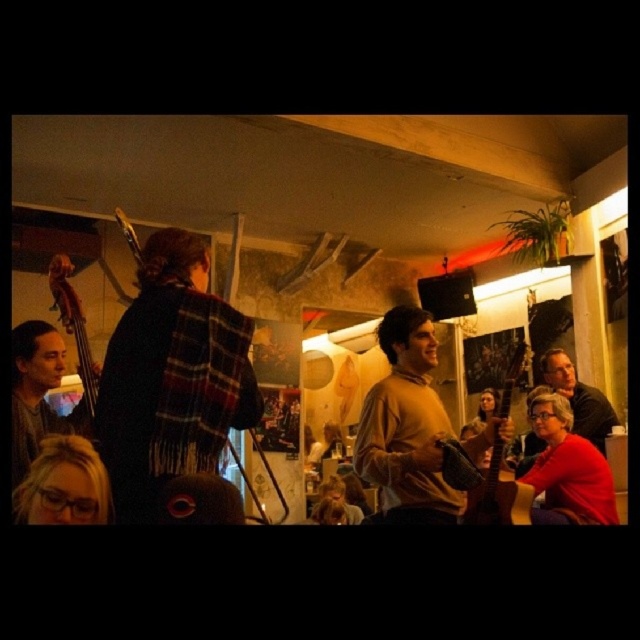
You are a photographer trying to capture the musician playing the wooden acoustic guitar at right. You want to focus on the point at coordinate point (x=497, y=493). Is this point located on the wooden acoustic guitar at right?

Yes, the point at coordinate (x=497, y=493) is located on the wooden acoustic guitar at right.

You are standing in the music venue and want to reach both points in the scene. Which point, point (44,497) or point (500,449), is closer to you?

Point (44,497) is closer to the viewer than point (500,449), so you should reach it first.

You are a musician who needs to choose between the wooden acoustic guitar at right and the matte black guitar at right based on their sizes. Which one is taller?

The wooden acoustic guitar at right has a greater height compared to the matte black guitar at right, so the wooden acoustic guitar at right is taller.